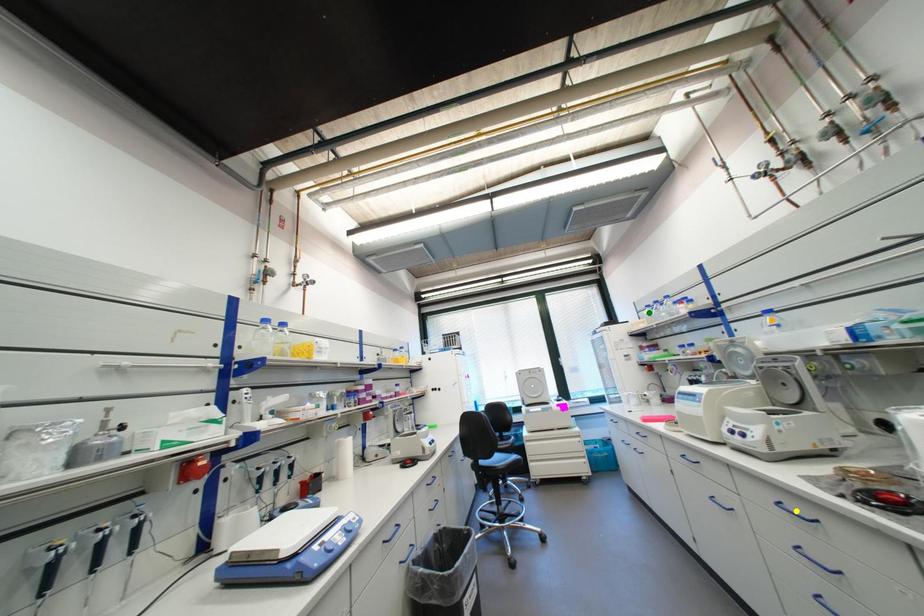
Order these from nearest to farthest:
A) yellow point
B) green point
C) orange point

yellow point < orange point < green point